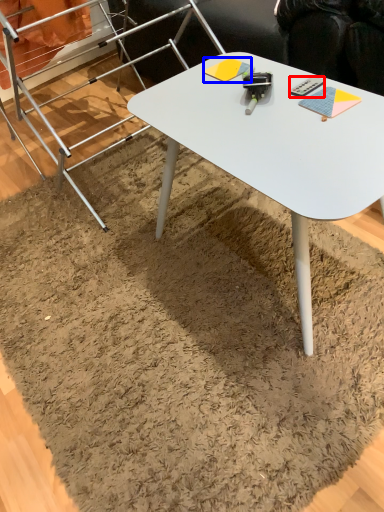
Question: Which point is further to the camera, remote control (highlighted by a red box) or notepad (highlighted by a blue box)?

Choices:
 (A) remote control
 (B) notepad

Answer: (B)